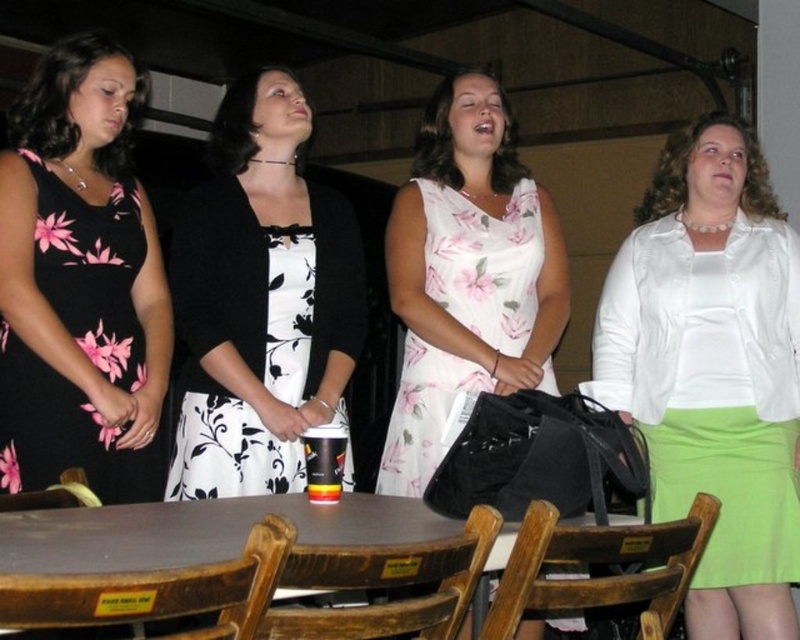
You are organizing a photo shoot and need to position a model next to the white satin blouse at center and the brown wooden table at center. According to the scene description, which object should the model stand to the right of?

The model should stand to the right of the brown wooden table at center because the white satin blouse at center is located to the right of the brown wooden table at center.

You are standing in the same room as the group of women and want to find the black floral dress at center. Based on the coordinates provided, can you estimate where it is located in the room?

The black floral dress at center is located at the coordinates point (260,300), which is slightly to the right and middle of the room.

You are organizing a photoshoot and need to arrange the women in order of their dress widths from narrowest to widest. Given that you see the black floral dress at center and the black floral dress at left, which dress should be placed first in the sequence?

The black floral dress at left should be placed first in the sequence since it is narrower than the black floral dress at center, which is wider.